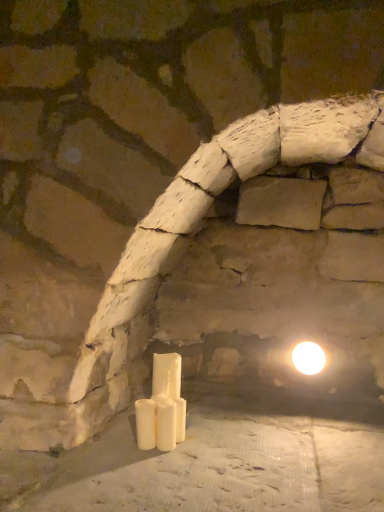
Describe the element at coordinates (166, 424) in the screenshot. The height and width of the screenshot is (512, 384). I see `white matte candle at center, the first candle viewed from the front` at that location.

Image resolution: width=384 pixels, height=512 pixels. What do you see at coordinates (162, 407) in the screenshot? I see `white glossy candle at center, the first candle positioned from the back` at bounding box center [162, 407].

Image resolution: width=384 pixels, height=512 pixels. What do you see at coordinates (145, 423) in the screenshot?
I see `white matte candle at lower center, which is the 2th candle in front-to-back order` at bounding box center [145, 423].

Find the location of a particular element. The image size is (384, 512). white matte candle at center, which is the 3th candle from back to front is located at coordinates (166, 424).

Is white matte candle at lower center, the 2th candle when ordered from back to front, facing away from white glossy candle at center, which is the third candle in front-to-back order?

Yes, white matte candle at lower center, the 2th candle when ordered from back to front, is positioned with its back facing white glossy candle at center, which is the third candle in front-to-back order.

Are white matte candle at lower center, the 2th candle when ordered from back to front, and white glossy candle at center, the first candle positioned from the back, beside each other?

Absolutely, white matte candle at lower center, the 2th candle when ordered from back to front, is next to and touching white glossy candle at center, the first candle positioned from the back.

Which of these two, white matte candle at lower center, the 2th candle when ordered from back to front, or white glossy candle at center, which is the third candle in front-to-back order, is wider?

white glossy candle at center, which is the third candle in front-to-back order.

Is white glossy candle at center, the first candle positioned from the back, closer to the viewer compared to white matte candle at lower center, the 2th candle when ordered from back to front?

No, it is behind white matte candle at lower center, the 2th candle when ordered from back to front.

From a real-world perspective, between white glossy candle at center, the first candle positioned from the back, and white matte candle at lower center, which is the 2th candle in front-to-back order, who is vertically lower?

white matte candle at lower center, which is the 2th candle in front-to-back order, from a real-world perspective.

Can we say white glossy candle at center, the first candle positioned from the back, lies outside white matte candle at lower center, which is the 2th candle in front-to-back order?

Yes, white glossy candle at center, the first candle positioned from the back, is not within white matte candle at lower center, which is the 2th candle in front-to-back order.

Is white glossy light bulb at upper right located within white matte candle at center, which is the 3th candle from back to front?

Actually, white glossy light bulb at upper right is outside white matte candle at center, which is the 3th candle from back to front.

Which object is thinner, white matte candle at center, the first candle viewed from the front, or white glossy light bulb at upper right?

With smaller width is white matte candle at center, the first candle viewed from the front.

From a real-world perspective, does white matte candle at center, which is the 3th candle from back to front, stand above white glossy light bulb at upper right?

No, from a real-world perspective, white matte candle at center, which is the 3th candle from back to front, is not above white glossy light bulb at upper right.

From the picture: Can you confirm if white matte candle at center, the first candle viewed from the front, is shorter than white glossy light bulb at upper right?

In fact, white matte candle at center, the first candle viewed from the front, may be taller than white glossy light bulb at upper right.

Which of these two, white glossy candle at center, the first candle positioned from the back, or white matte candle at center, which is the 3th candle from back to front, is smaller?

white matte candle at center, which is the 3th candle from back to front.

From their relative heights in the image, would you say white glossy candle at center, which is the third candle in front-to-back order, is taller or shorter than white matte candle at center, the first candle viewed from the front?

Clearly, white glossy candle at center, which is the third candle in front-to-back order, is taller compared to white matte candle at center, the first candle viewed from the front.

From a real-world perspective, between white glossy candle at center, which is the third candle in front-to-back order, and white matte candle at center, the first candle viewed from the front, who is vertically lower?

From a 3D spatial view, white matte candle at center, the first candle viewed from the front, is below.

Based on the photo, is white glossy candle at center, which is the third candle in front-to-back order, wider than white matte candle at center, the first candle viewed from the front?

Indeed, white glossy candle at center, which is the third candle in front-to-back order, has a greater width compared to white matte candle at center, the first candle viewed from the front.

Is white glossy light bulb at upper right outside of white matte candle at lower center, the 2th candle when ordered from back to front?

That's correct, white glossy light bulb at upper right is outside of white matte candle at lower center, the 2th candle when ordered from back to front.

Is white glossy light bulb at upper right touching white matte candle at lower center, the 2th candle when ordered from back to front?

white glossy light bulb at upper right and white matte candle at lower center, the 2th candle when ordered from back to front, are not in contact.

Can you tell me how much white glossy light bulb at upper right and white matte candle at lower center, which is the 2th candle in front-to-back order, differ in facing direction?

The facing directions of white glossy light bulb at upper right and white matte candle at lower center, which is the 2th candle in front-to-back order, are 1.58 degrees apart.

From the picture: Is white matte candle at center, the first candle viewed from the front, in contact with white matte candle at lower center, which is the 2th candle in front-to-back order?

Yes, white matte candle at center, the first candle viewed from the front, is in contact with white matte candle at lower center, which is the 2th candle in front-to-back order.

From a real-world perspective, does white matte candle at center, the first candle viewed from the front, stand above white matte candle at lower center, which is the 2th candle in front-to-back order?

Yes, from a real-world perspective, white matte candle at center, the first candle viewed from the front, is on top of white matte candle at lower center, which is the 2th candle in front-to-back order.

Which of these two, white matte candle at center, the first candle viewed from the front, or white matte candle at lower center, the 2th candle when ordered from back to front, is smaller?

white matte candle at lower center, the 2th candle when ordered from back to front, is smaller.

The height and width of the screenshot is (512, 384). Identify the location of moonlight that appears on the right of white glossy candle at center, the first candle positioned from the back. (308, 358).

In terms of width, does white glossy light bulb at upper right look wider or thinner when compared to white glossy candle at center, which is the third candle in front-to-back order?

In the image, white glossy light bulb at upper right appears to be wider than white glossy candle at center, which is the third candle in front-to-back order.

From a real-world perspective, is white glossy light bulb at upper right physically located above or below white glossy candle at center, the first candle positioned from the back?

white glossy light bulb at upper right is above white glossy candle at center, the first candle positioned from the back.

Could you tell me if white glossy light bulb at upper right is turned towards white glossy candle at center, which is the third candle in front-to-back order?

No, white glossy light bulb at upper right is not aimed at white glossy candle at center, which is the third candle in front-to-back order.

This screenshot has width=384, height=512. In order to click on candle located above the white matte candle at lower center, which is the 2th candle in front-to-back order (from the image's perspective) in this screenshot , I will do `click(162, 407)`.

What are the coordinates of `the 1st candle counting from the right of the white matte candle at lower center, which is the 2th candle in front-to-back order` in the screenshot? It's located at (162, 407).

Which object lies further to the anchor point white matte candle at center, the first candle viewed from the front, white matte candle at lower center, which is the 2th candle in front-to-back order, or white glossy candle at center, the first candle positioned from the back?

Based on the image, white glossy candle at center, the first candle positioned from the back, appears to be further to white matte candle at center, the first candle viewed from the front.

From the image, which object appears to be farther from white matte candle at center, the first candle viewed from the front, white glossy candle at center, the first candle positioned from the back, or white glossy light bulb at upper right?

white glossy light bulb at upper right lies further to white matte candle at center, the first candle viewed from the front, than the other object.

Considering their positions, is white glossy light bulb at upper right positioned closer to white matte candle at center, the first candle viewed from the front, than white matte candle at lower center, the 2th candle when ordered from back to front?

Among the two, white matte candle at lower center, the 2th candle when ordered from back to front, is located nearer to white matte candle at center, the first candle viewed from the front.

Which object lies nearer to the anchor point white matte candle at center, which is the 3th candle from back to front, white glossy light bulb at upper right or white glossy candle at center, which is the third candle in front-to-back order?

Among the two, white glossy candle at center, which is the third candle in front-to-back order, is located nearer to white matte candle at center, which is the 3th candle from back to front.

Based on their spatial positions, is white matte candle at center, which is the 3th candle from back to front, or white glossy candle at center, the first candle positioned from the back, closer to white glossy light bulb at upper right?

white glossy candle at center, the first candle positioned from the back, is positioned closer to the anchor white glossy light bulb at upper right.

Estimate the real-world distances between objects in this image. Which object is closer to white glossy light bulb at upper right, white matte candle at lower center, which is the 2th candle in front-to-back order, or white glossy candle at center, which is the third candle in front-to-back order?

The object closer to white glossy light bulb at upper right is white glossy candle at center, which is the third candle in front-to-back order.

From the image, which object appears to be farther from white glossy candle at center, the first candle positioned from the back, white matte candle at lower center, the 2th candle when ordered from back to front, or white glossy light bulb at upper right?

Based on the image, white glossy light bulb at upper right appears to be further to white glossy candle at center, the first candle positioned from the back.

From the image, which object appears to be farther from white glossy light bulb at upper right, white glossy candle at center, which is the third candle in front-to-back order, or white matte candle at center, the first candle viewed from the front?

white matte candle at center, the first candle viewed from the front, is positioned further to the anchor white glossy light bulb at upper right.

At what (x,y) coordinates should I click in order to perform the action: click on candle located between white matte candle at center, the first candle viewed from the front, and white glossy candle at center, the first candle positioned from the back, in the depth direction. Please return your answer as a coordinate pair (x, y). Image resolution: width=384 pixels, height=512 pixels. Looking at the image, I should click on (145, 423).

Identify the location of candle situated between white glossy candle at center, the first candle positioned from the back, and white glossy light bulb at upper right from left to right. The image size is (384, 512). (166, 424).